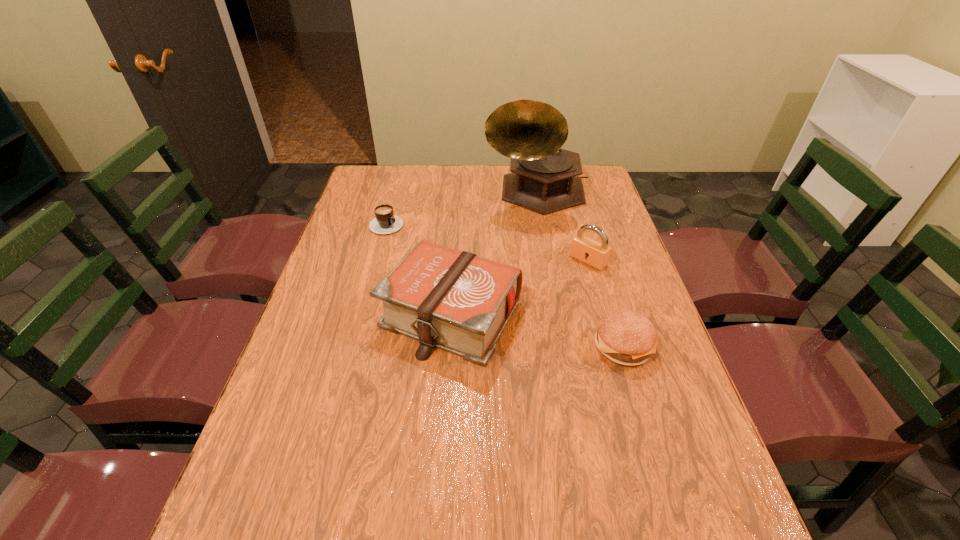
Where is `vacant space located 0.300m to unlock the padlock from the front`? vacant space located 0.300m to unlock the padlock from the front is located at coordinates (516, 328).

I want to click on free spot located 0.350m to unlock the padlock from the front, so click(x=504, y=339).

Find the location of a particular element. vacant space located 0.120m to unlock the padlock from the front is located at coordinates (556, 291).

Image resolution: width=960 pixels, height=540 pixels. In order to click on free space located 0.360m with the handle on the side of the shortest object in this screenshot , I will do `click(475, 286)`.

This screenshot has height=540, width=960. Identify the location of vacant space located with the handle on the side of the shortest object. (468, 281).

This screenshot has width=960, height=540. I want to click on vacant space situated 0.050m with the handle on the side of the shortest object, so (x=406, y=238).

Identify the location of object that is positioned at the far edge. (545, 179).

The width and height of the screenshot is (960, 540). I want to click on object that is positioned at the left edge, so click(x=386, y=222).

Where is `hamburger present at the right edge`? The width and height of the screenshot is (960, 540). hamburger present at the right edge is located at coordinates (625, 337).

Where is `phonograph record at the right edge`? This screenshot has height=540, width=960. phonograph record at the right edge is located at coordinates (545, 179).